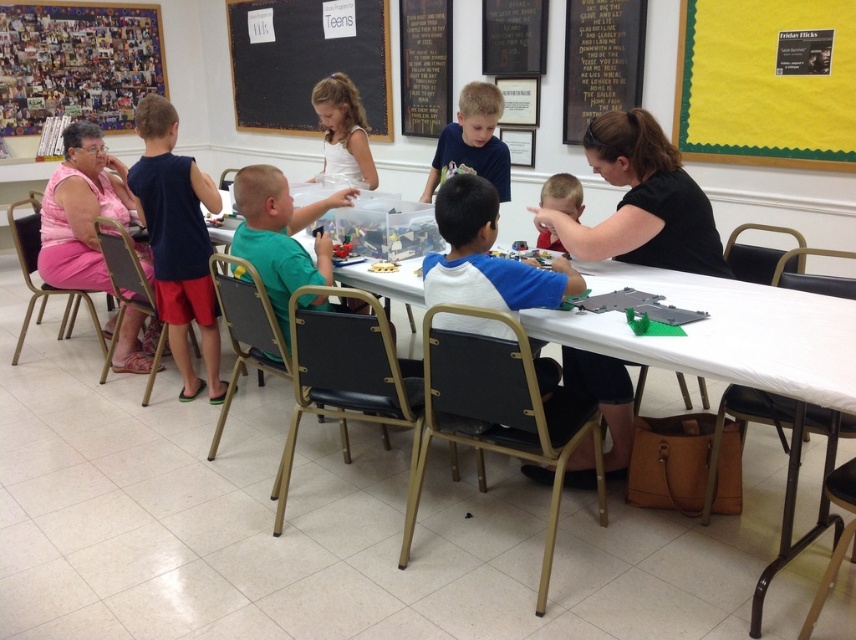
Question: Considering the real-world distances, which object is farthest from the green fabric chair at center?

Choices:
 (A) white plastic table at center
 (B) white satin dress at center
 (C) black matte shirt at upper right
 (D) matte blue shirt at left

Answer: (A)

Question: Does black matte shirt at upper right lie in front of white satin dress at center?

Choices:
 (A) no
 (B) yes

Answer: (B)

Question: Does matte blue shirt at left have a greater width compared to blue matte shirt at center?

Choices:
 (A) no
 (B) yes

Answer: (B)

Question: Which object is farther from the camera taking this photo?

Choices:
 (A) white satin dress at center
 (B) pink fabric dress at left

Answer: (A)

Question: Observing the image, what is the correct spatial positioning of blue matte shirt at center in reference to smooth plastic toy at center?

Choices:
 (A) above
 (B) below

Answer: (A)

Question: Considering the real-world distances, which object is closest to the blue matte shirt at center?

Choices:
 (A) white satin dress at center
 (B) smooth plastic toy at center
 (C) matte blue shirt at left

Answer: (A)